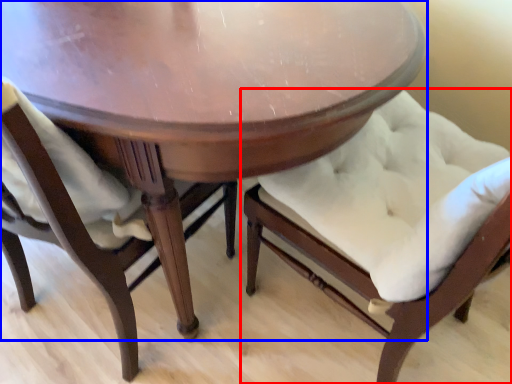
Question: Which point is further to the camera, chair (highlighted by a red box) or table (highlighted by a blue box)?

Choices:
 (A) chair
 (B) table

Answer: (B)